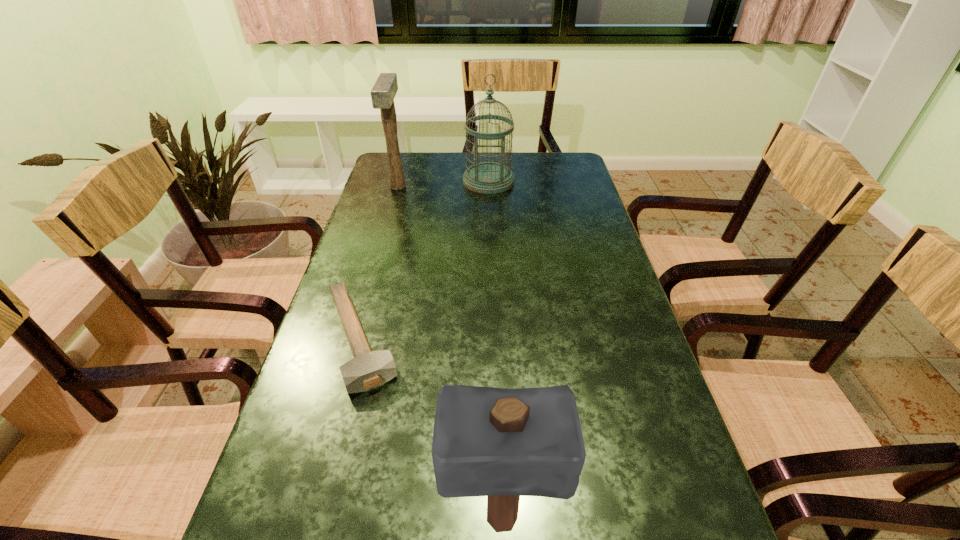
Where is `vacant area at the far edge of the desktop`? vacant area at the far edge of the desktop is located at coordinates (433, 164).

Locate an element on the screen. The height and width of the screenshot is (540, 960). vacant region at the right edge is located at coordinates (572, 331).

This screenshot has width=960, height=540. Identify the location of vacant region at the far left corner of the desktop. (413, 172).

Image resolution: width=960 pixels, height=540 pixels. In order to click on free location at the far right corner in this screenshot , I will do `click(564, 161)`.

Find the location of a particular element. The width and height of the screenshot is (960, 540). free spot between the farthest mallet and the birdcage is located at coordinates (444, 184).

Locate an element on the screen. This screenshot has height=540, width=960. vacant space that's between the farthest mallet and the second nearest object is located at coordinates (379, 263).

I want to click on free point between the farthest mallet and the birdcage, so click(444, 184).

Locate an element on the screen. This screenshot has width=960, height=540. empty space that is in between the birdcage and the farthest mallet is located at coordinates (444, 184).

Point out which object is positioned as the third nearest to the birdcage. Please provide its 2D coordinates. Your answer should be formatted as a tuple, i.e. [(x, y)], where the tuple contains the x and y coordinates of a point satisfying the conditions above.

[(502, 443)]

Locate an element on the screen. The width and height of the screenshot is (960, 540). object that stands as the closest to the birdcage is located at coordinates (384, 90).